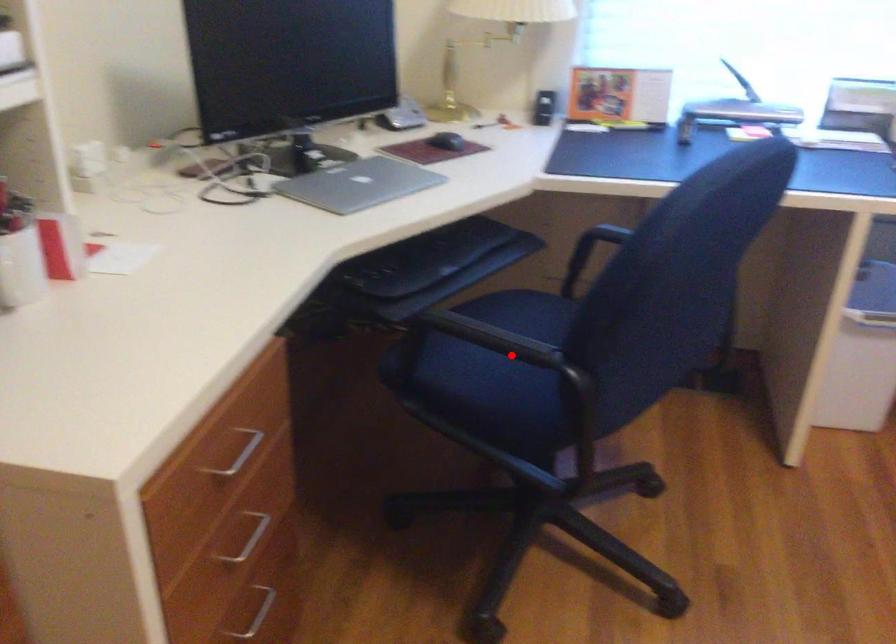
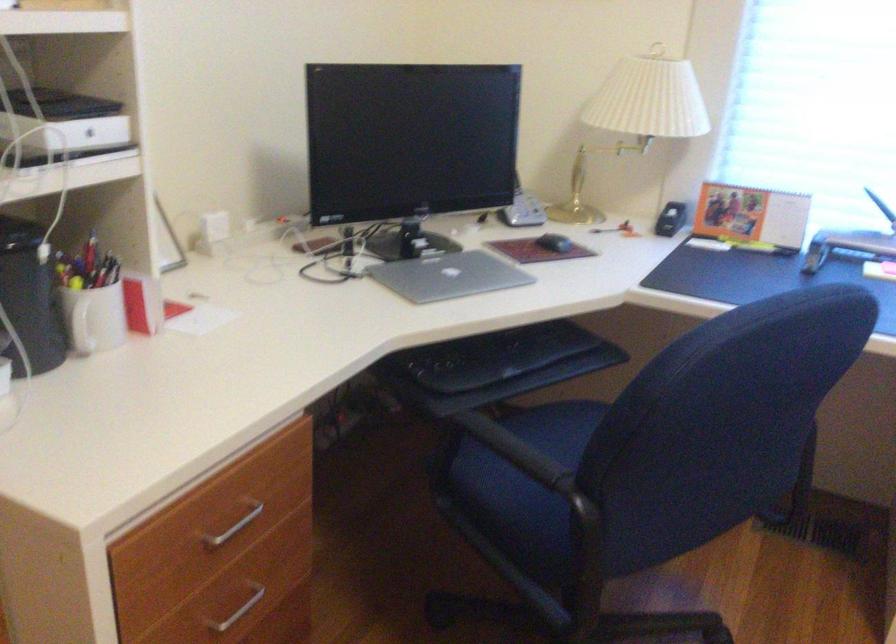
Locate, in the second image, the point that corresponds to the highlighted location in the first image.

(524, 462)